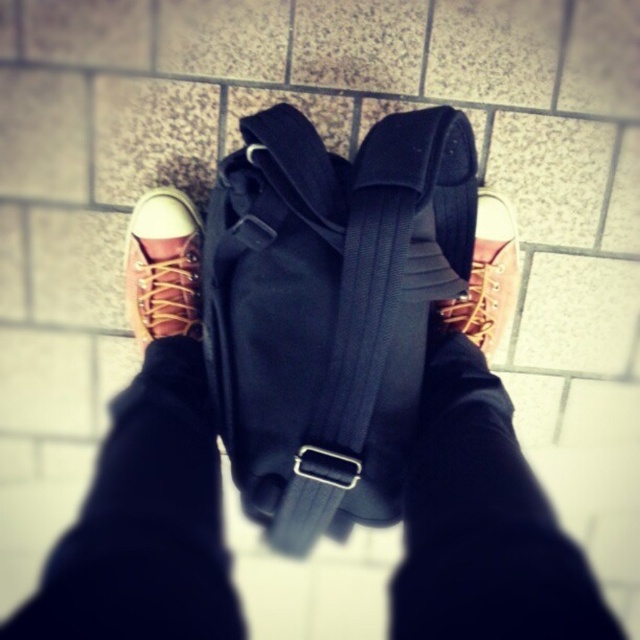
You are standing on the tiled floor and see the black fabric backpack at center. If you want to place a small item on the backpack, where exactly should you aim?

The black fabric backpack at center is located at point (330, 308), so you should aim for that coordinate to place the small item.

You are standing at the point marked by the coordinates point (90, 564) and want to take a photo of the black backpack with multiple straps and buckles. If your camera is 20.95 inches away from you, will it be able to capture the entire backpack in the frame?

The point (90, 564) is 20.95 inches away from the camera. Since the camera is positioned at that distance, it should be able to capture the entire backpack in the frame if the backpack fits within the camera lens field of view at that distance.